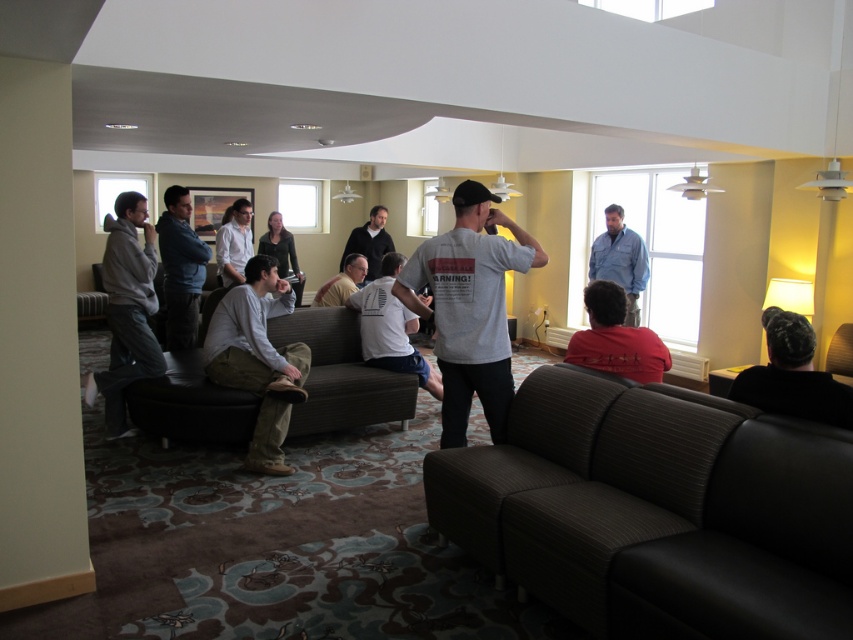
Is white cotton t-shirt at center further to camera compared to white cotton shirt at center?

No, white cotton t-shirt at center is in front of white cotton shirt at center.

Between white cotton t-shirt at center and white cotton shirt at center, which one has less height?

white cotton shirt at center

Which is in front, point (447, 257) or point (396, 268)?

Point (447, 257) is in front.

I want to click on white cotton t-shirt at center, so click(469, 307).

Does dark gray fabric couch at center have a greater width compared to denim shirt at upper right?

Indeed, dark gray fabric couch at center has a greater width compared to denim shirt at upper right.

Does point (236, 406) lie behind point (593, 266)?

No.

Between point (294, 340) and point (618, 268), which one is positioned in front?

Point (294, 340) is in front.

This screenshot has height=640, width=853. Identify the location of dark gray fabric couch at center. (340, 374).

Who is positioned more to the left, white cotton shirt at center or light brown leather jacket at center?

light brown leather jacket at center

Find the location of a particular element. This screenshot has height=640, width=853. white cotton shirt at center is located at coordinates (390, 326).

Does point (399, 323) come in front of point (323, 284)?

Yes, point (399, 323) is closer to viewer.

This screenshot has height=640, width=853. Find the location of `white cotton shirt at center`. white cotton shirt at center is located at coordinates (390, 326).